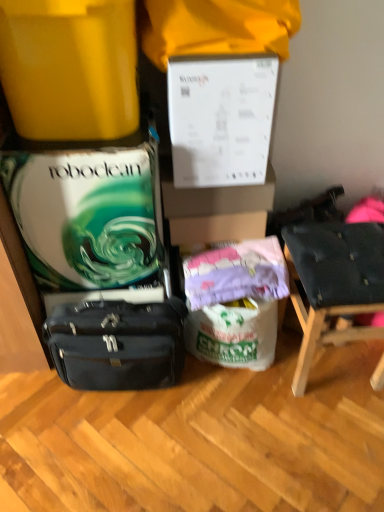
Question: Considering the relative sizes of purple fabric at center and dark blue fabric chair at right in the image provided, is purple fabric at center shorter than dark blue fabric chair at right?

Choices:
 (A) no
 (B) yes

Answer: (B)

Question: Does purple fabric at center appear on the right side of dark blue fabric chair at right?

Choices:
 (A) no
 (B) yes

Answer: (A)

Question: Does purple fabric at center come behind dark blue fabric chair at right?

Choices:
 (A) yes
 (B) no

Answer: (A)

Question: From the image's perspective, is purple fabric at center on top of dark blue fabric chair at right?

Choices:
 (A) yes
 (B) no

Answer: (A)

Question: Is the depth of purple fabric at center less than that of dark blue fabric chair at right?

Choices:
 (A) no
 (B) yes

Answer: (A)

Question: Is point (x=382, y=370) closer or farther from the camera than point (x=66, y=26)?

Choices:
 (A) farther
 (B) closer

Answer: (A)

Question: Considering their positions, is dark blue fabric chair at right located in front of or behind matte yellow container at upper left?

Choices:
 (A) behind
 (B) front

Answer: (A)

Question: In terms of width, does dark blue fabric chair at right look wider or thinner when compared to matte yellow container at upper left?

Choices:
 (A) thin
 (B) wide

Answer: (A)

Question: From a real-world perspective, relative to matte yellow container at upper left, is dark blue fabric chair at right vertically above or below?

Choices:
 (A) below
 (B) above

Answer: (A)

Question: From a real-world perspective, is matte yellow container at upper left above or below purple fabric at center?

Choices:
 (A) below
 (B) above

Answer: (B)

Question: In the image, is matte yellow container at upper left positioned in front of or behind purple fabric at center?

Choices:
 (A) front
 (B) behind

Answer: (A)

Question: From the image's perspective, is matte yellow container at upper left positioned above or below purple fabric at center?

Choices:
 (A) above
 (B) below

Answer: (A)

Question: In terms of height, does matte yellow container at upper left look taller or shorter compared to purple fabric at center?

Choices:
 (A) short
 (B) tall

Answer: (B)

Question: Is matte yellow container at upper left taller or shorter than matte black briefcase at lower left?

Choices:
 (A) tall
 (B) short

Answer: (B)

Question: Considering the positions of point (57, 13) and point (94, 342), is point (57, 13) closer or farther from the camera than point (94, 342)?

Choices:
 (A) closer
 (B) farther

Answer: (A)